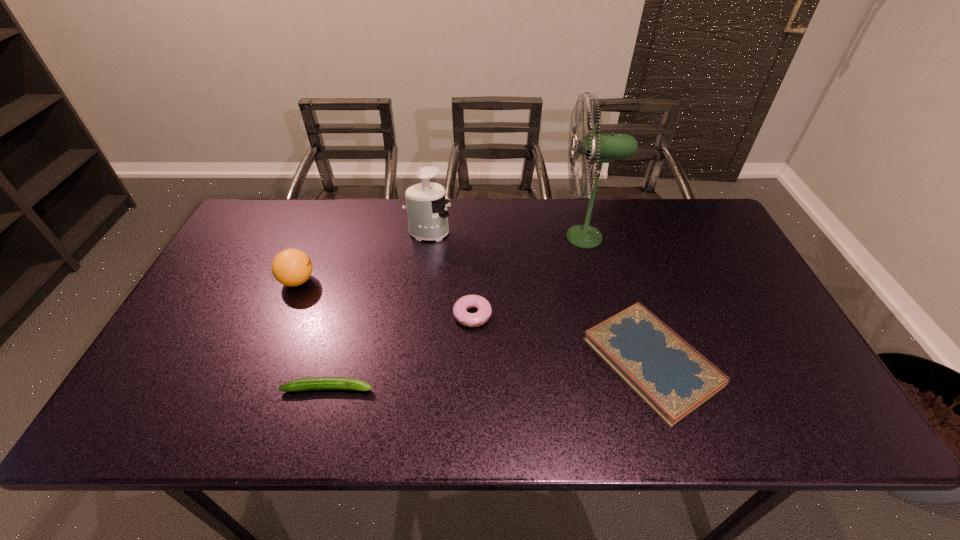
Identify the location of free space that satisfies the following two spatial constraints: 1. on the side with brand of the paperback book; 2. on the right side of the third tallest object. This screenshot has height=540, width=960. pos(265,361).